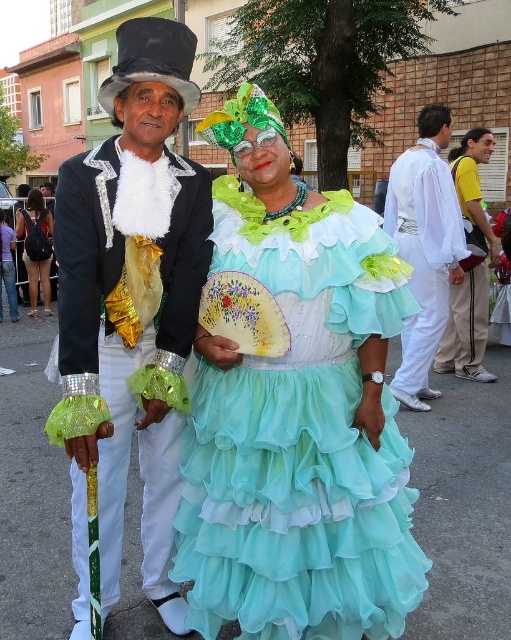
Which of these two, turquoise chiffon dress at center or shiny black fabric top hat at upper left, stands shorter?

turquoise chiffon dress at center

Does turquoise chiffon dress at center have a lesser height compared to shiny black fabric top hat at upper left?

Yes.

Who is more distant from viewer, (269, 360) or (128, 426)?

Point (128, 426)

Find the location of `turquoise chiffon dress at center`. turquoise chiffon dress at center is located at coordinates (300, 440).

In the scene shown: Does turquoise chiffon dress at center appear over matte black backpack at left?

Incorrect, turquoise chiffon dress at center is not positioned above matte black backpack at left.

Describe the element at coordinates (300, 440) in the screenshot. I see `turquoise chiffon dress at center` at that location.

Image resolution: width=511 pixels, height=640 pixels. I want to click on turquoise chiffon dress at center, so (300, 440).

Consider the image. Between turquoise chiffon dress at center and yellow t-shirt at center, which one appears on the left side from the viewer's perspective?

Positioned to the left is turquoise chiffon dress at center.

Who is more forward, (199, 444) or (487, 273)?

Point (199, 444)

Identify the location of turquoise chiffon dress at center. This screenshot has width=511, height=640. (300, 440).